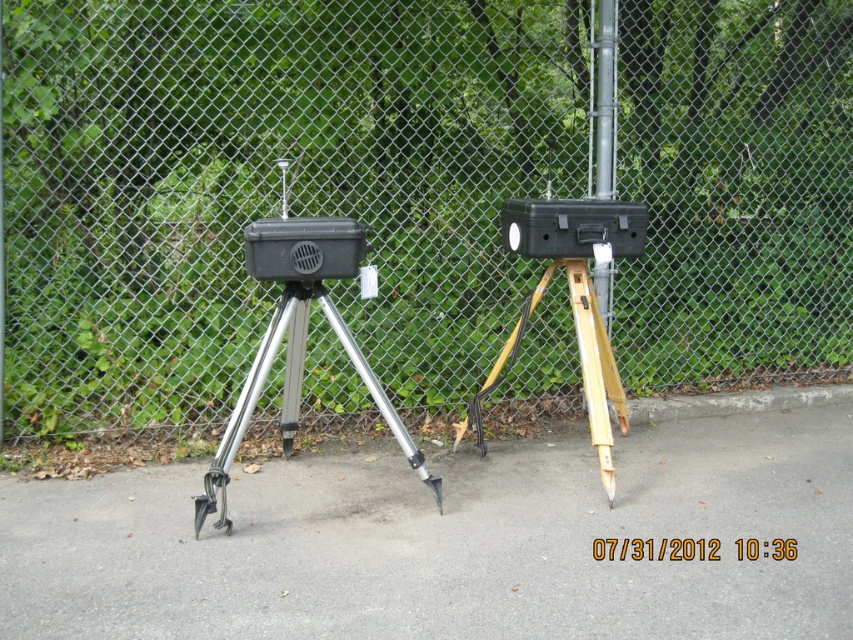
You are a technician who needs to place a 1.5 meter long tool between the metal mesh fence at center and the wooden tripod at center. Is there enough space to fit the tool horizontally between them?

The metal mesh fence at center is 92.44 centimeters away from the wooden tripod at center. Since 92.44 centimeters is less than 1.5 meters, there is not enough space to fit the tool horizontally between them.

You are a delivery person trying to place a package on the ground between the metal mesh fence at center and the gray asphalt pavement at center. Can you place it there without it rolling away?

The metal mesh fence at center is located above gray asphalt pavement at center, so there is no space between them. You cannot place the package there without it rolling away.